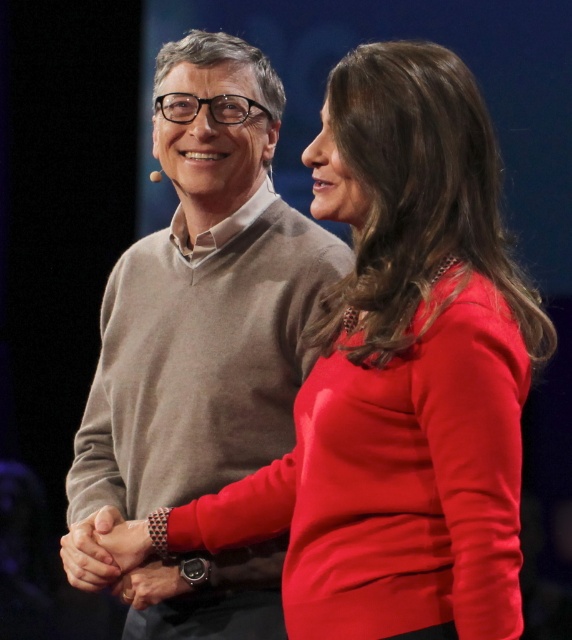
Question: Does matte gray sweater at center come behind matte black hands at center?

Choices:
 (A) no
 (B) yes

Answer: (B)

Question: Can you confirm if matte gray sweater at center is positioned to the right of matte black hands at center?

Choices:
 (A) yes
 (B) no

Answer: (A)

Question: Is matte gray sweater at center positioned before matte black hands at center?

Choices:
 (A) no
 (B) yes

Answer: (A)

Question: Among these objects, which one is nearest to the camera?

Choices:
 (A) matte gray sweater at center
 (B) matte black hands at center

Answer: (B)